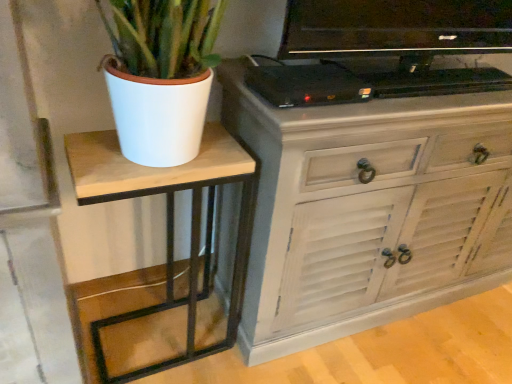
Where is `free area below wooden table at left (from a real-world perspective)`? The image size is (512, 384). free area below wooden table at left (from a real-world perspective) is located at coordinates coord(160,327).